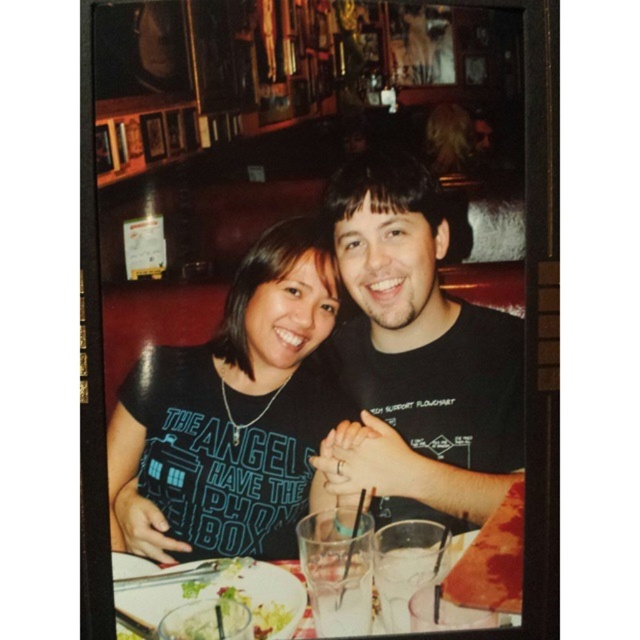
You are a photographer standing at the entrance of the restaurant. You want to take a photo of the black matte shirt at center. Where should you position yourself to capture the shirt in the best possible frame?

To capture the black matte shirt at center in the best frame, position yourself directly facing the shirt at the coordinates provided, ensuring it remains centered in your viewfinder.

You are a bartender preparing to place a black matte shirt at center and a clear glassware at center on a narrow shelf. The shelf can only hold items up to 10 cm in width. Which item should you place first to ensure both fit?

The black matte shirt at center is thinner than the clear glassware at center, so you should place the clear glassware at center first to ensure both items fit on the shelf.